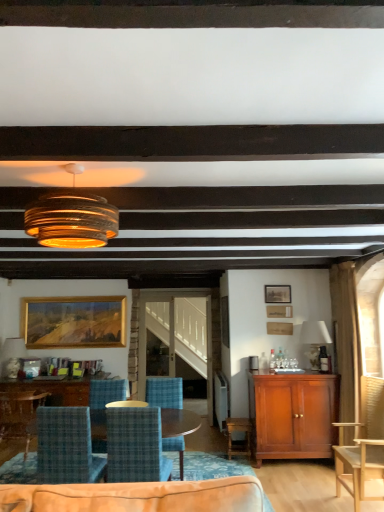
Question: From a real-world perspective, is blue plaid fabric chair at center, which appears as the third chair when viewed from the left, physically located above or below wooden picture frame at upper right, arranged as the 2th picture frame when ordered from the bottom?

Choices:
 (A) below
 (B) above

Answer: (A)

Question: Looking at the image, does blue plaid fabric chair at center, arranged as the third chair when viewed from the right, seem bigger or smaller compared to wooden picture frame at upper right, the 2th picture frame in the left-to-right sequence?

Choices:
 (A) big
 (B) small

Answer: (A)

Question: Which object is the closest to the mahogany cabinet at right?

Choices:
 (A) blue plaid chair at lower left, which is the 5th chair from right to left
 (B) blue plaid chair at lower left, placed as the 4th chair when sorted from right to left
 (C) blue plaid fabric chair at center, arranged as the fourth chair when viewed from the left
 (D) clear glass door at center
 (E) blue plaid fabric chair at center, which appears as the third chair when viewed from the left

Answer: (D)

Question: Which object is the closest to the blue plaid chair at lower left, the 2th chair in the left-to-right sequence?

Choices:
 (A) matte glass lampshade at upper center, which appears as the third lamp when viewed from the top
 (B) light wood chair at right, the 5th chair from the left
 (C) blue plaid fabric chair at center, which appears as the third chair when viewed from the left
 (D) gold wooden picture frame at upper left, which is counted as the 1th picture frame, starting from the back
 (E) translucent amber glass pendant light at upper center, acting as the third lamp starting from the bottom

Answer: (C)